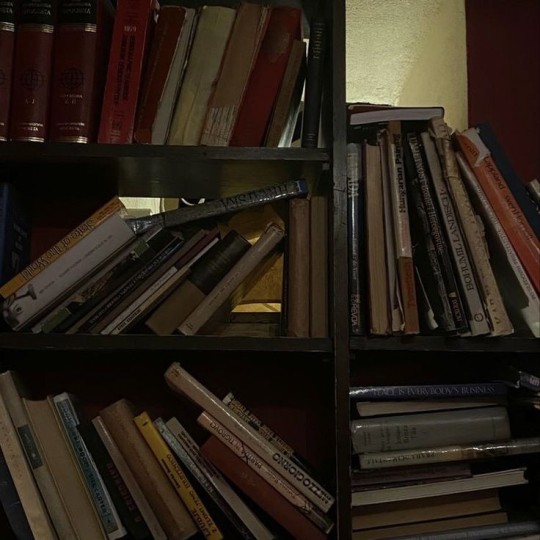
Identify the location of set of books. The height and width of the screenshot is (540, 540). (74, 87), (43, 78), (12, 63).